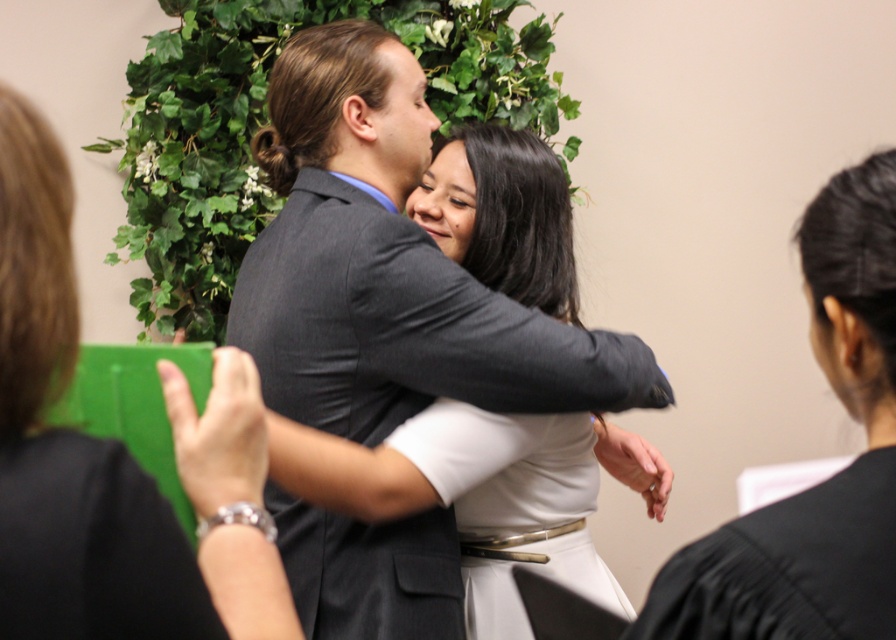
You are a photographer setting up for a formal event. You need to position a spotlight above the dark gray suit at center and the matte black dress at center. According to the scene description, which object should the spotlight be placed above?

The spotlight should be placed above the dark gray suit at center because it is positioned above the matte black dress at center in the scene.

You are standing in the same room as the couple and want to take a photo of them. The camera you are using has a focus point at the center of the frame, which corresponds to the coordinate point (389, 266). Will the dark gray suit at center be in focus if you aim the camera at that point?

Yes, the dark gray suit at center is located at point (389, 266), so aiming the camera at that coordinate will place the dark gray suit at center in focus.